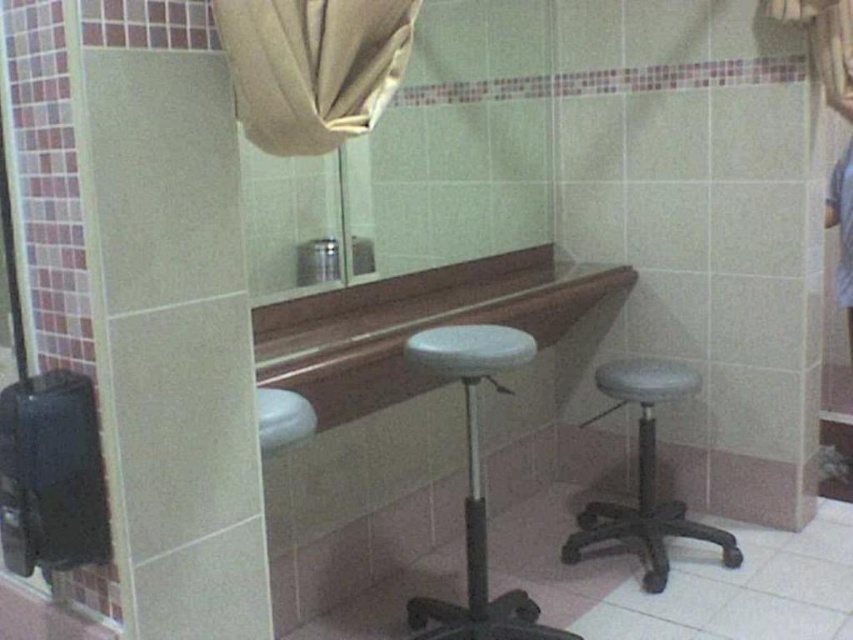
Question: Does gray matte bar stool at center lie in front of white glossy sink at center?

Choices:
 (A) yes
 (B) no

Answer: (B)

Question: Which point is closer to the camera taking this photo?

Choices:
 (A) (424, 605)
 (B) (647, 572)
 (C) (294, 435)

Answer: (C)

Question: Does matte glass mirror at center have a smaller size compared to gray matte bar stool at center?

Choices:
 (A) no
 (B) yes

Answer: (A)

Question: Which point is farther from the camera taking this photo?

Choices:
 (A) (x=367, y=29)
 (B) (x=497, y=220)
 (C) (x=691, y=376)

Answer: (B)

Question: Observing the image, what is the correct spatial positioning of matte glass mirror at center in reference to white matte bar stool at center?

Choices:
 (A) left
 (B) right

Answer: (A)

Question: Which point is farther to the camera?

Choices:
 (A) beige fabric curtain at upper center
 (B) gray matte bar stool at center

Answer: (B)